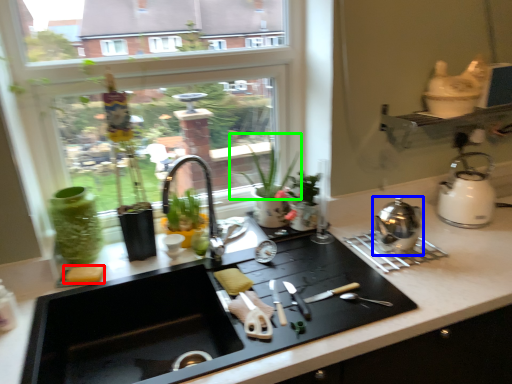
Question: Which object is positioned farthest from food (highlighted by a red box)? Select from kitchen appliance (highlighted by a blue box) and plant (highlighted by a green box).

Choices:
 (A) kitchen appliance
 (B) plant

Answer: (B)